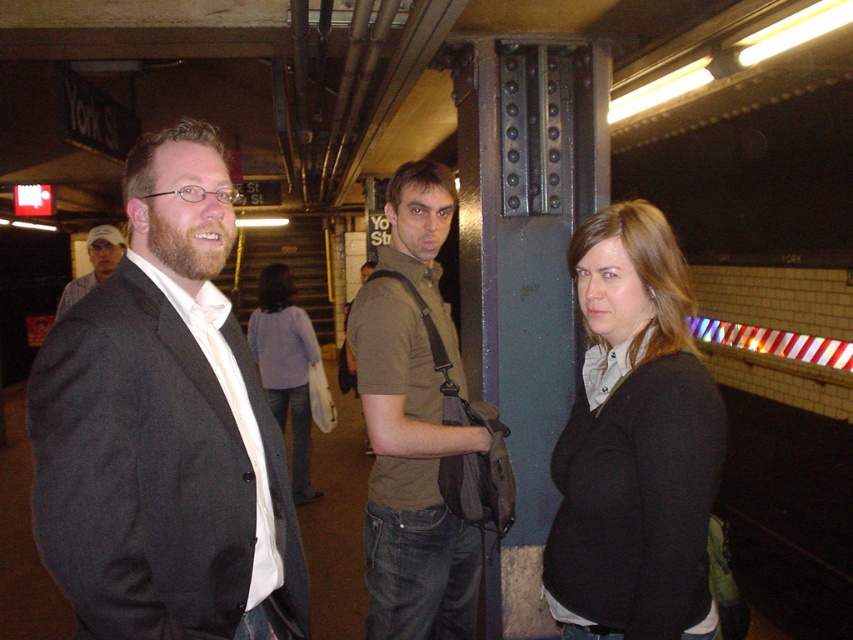
Who is positioned more to the right, matte black suit at left or matte brown shirt at center?

From the viewer's perspective, matte brown shirt at center appears more on the right side.

Between point (97, 524) and point (444, 198), which one is positioned behind?

The point (444, 198) is behind.

Identify the location of matte black suit at left. Image resolution: width=853 pixels, height=640 pixels. (164, 429).

Looking at this image, can you confirm if black matte sweater at center is positioned below bearded man at left?

Indeed, black matte sweater at center is positioned under bearded man at left.

Is the position of black matte sweater at center more distant than that of bearded man at left?

No, it is in front of bearded man at left.

Locate an element on the screen. black matte sweater at center is located at coordinates (634, 444).

Who is shorter, matte black suit at left or bearded man at left?

bearded man at left

Is point (170, 358) positioned in front of point (90, 228)?

Yes, it is.

In order to click on matte black suit at left in this screenshot , I will do `click(164, 429)`.